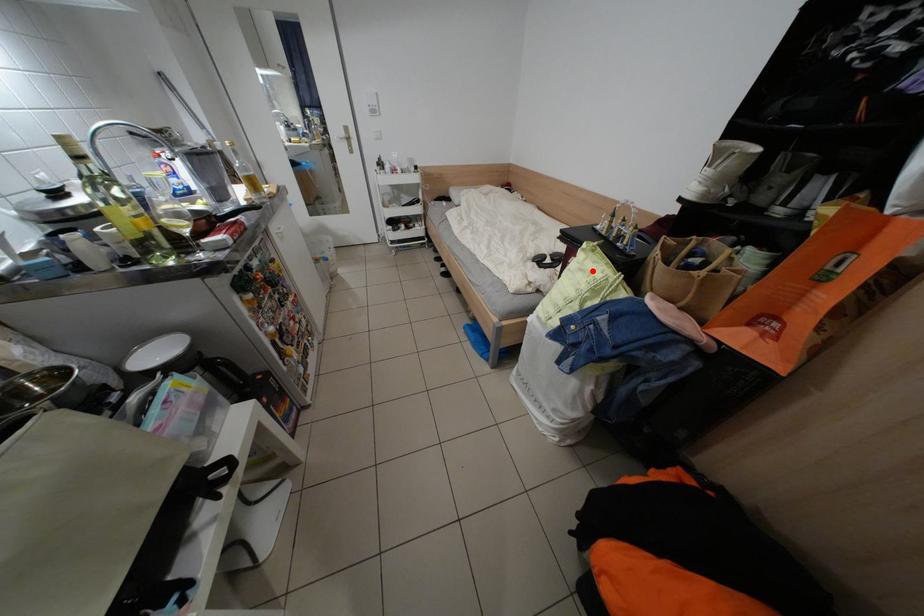
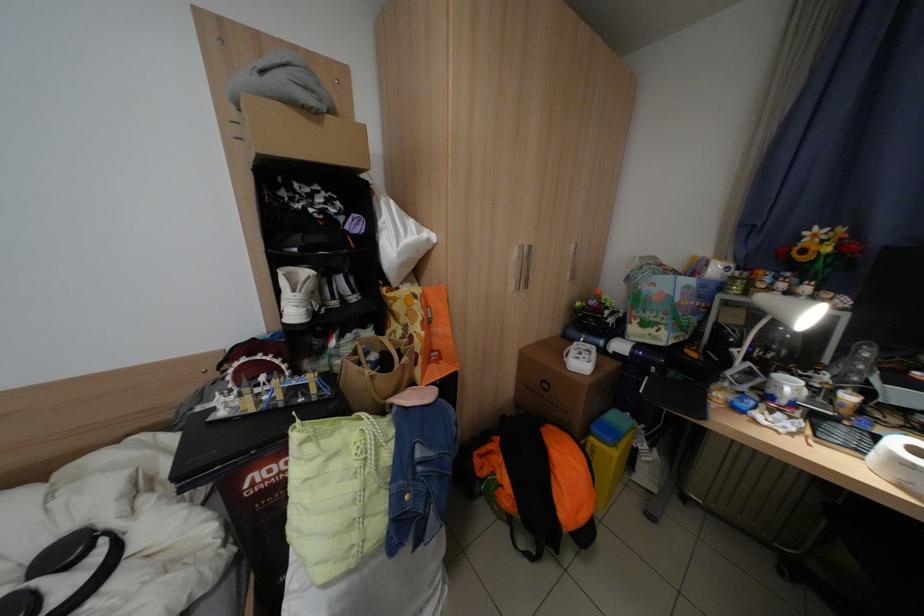
The point at the highlighted location is marked in the first image. Where is the corresponding point in the second image?

(342, 460)